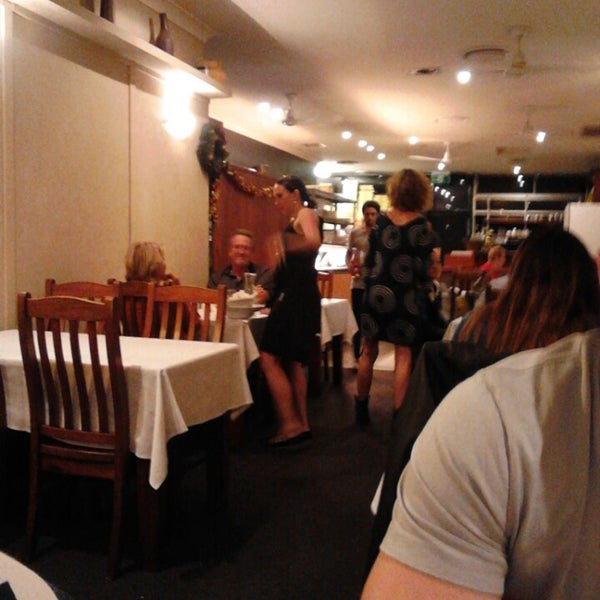
Identify the location of table. (171, 368), (329, 310).